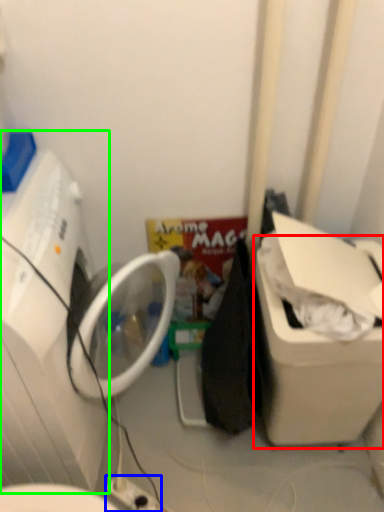
Question: Considering the real-world distances, which object is farthest from water cooler (highlighted by a red box)? electric outlet (highlighted by a blue box) or washing machine (highlighted by a green box)?

Choices:
 (A) electric outlet
 (B) washing machine

Answer: (B)